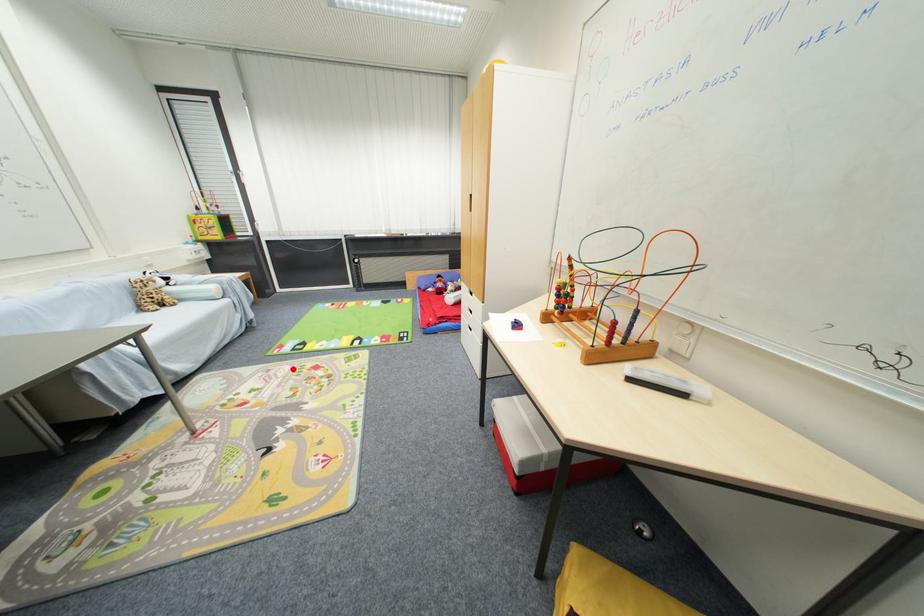
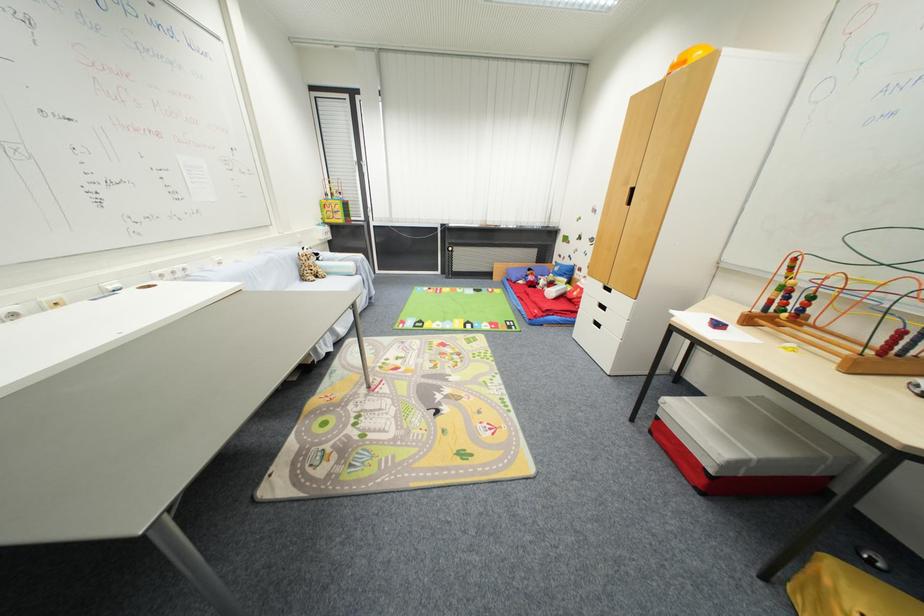
Find the pixel in the second image that matches the highlighted location in the first image.

(423, 342)